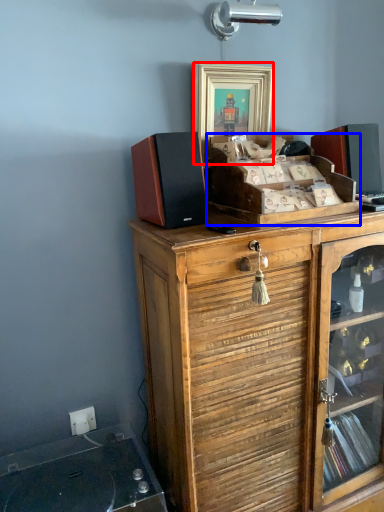
Question: Which object is closer to the camera taking this photo, picture frame (highlighted by a red box) or cabinetry (highlighted by a blue box)?

Choices:
 (A) picture frame
 (B) cabinetry

Answer: (B)